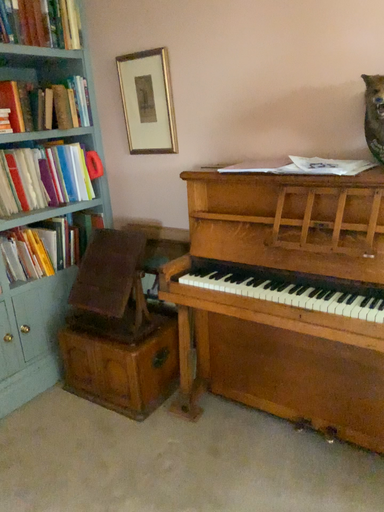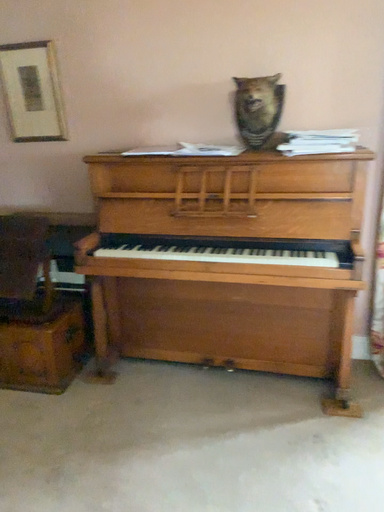
Question: How did the camera likely rotate when shooting the video?

Choices:
 (A) rotated right
 (B) rotated left

Answer: (A)